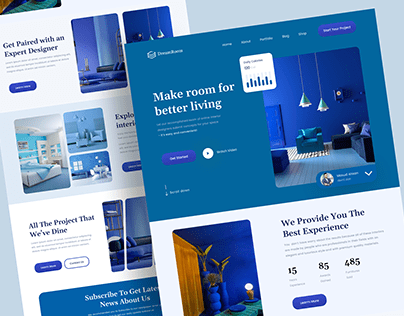
I want to click on images of striking interior design, primary colors are blue and white, so click(x=321, y=115), click(x=221, y=289), click(x=151, y=24), click(x=94, y=57), click(x=89, y=120), click(x=41, y=149), click(x=97, y=167), click(x=115, y=232), click(x=142, y=231), click(x=12, y=5).